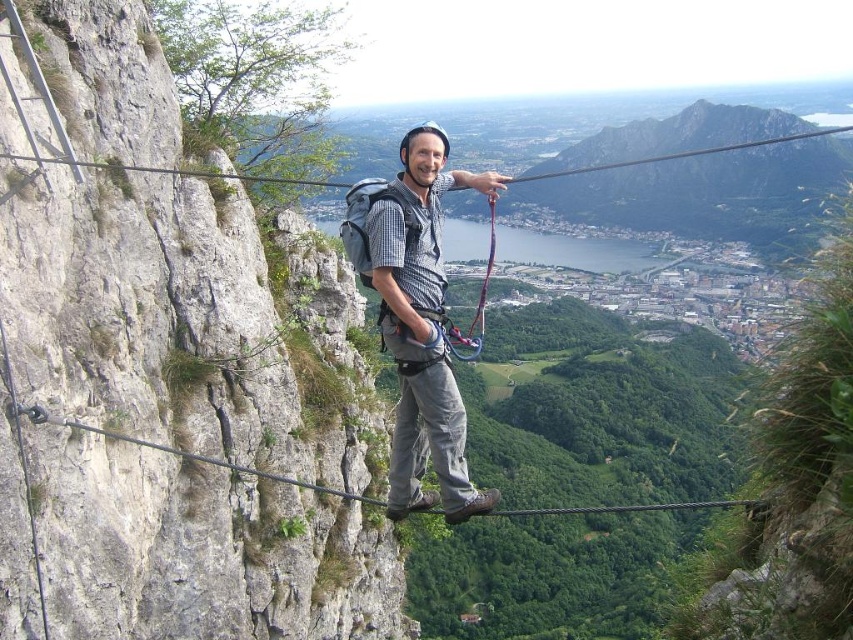
Which is above, smooth gray rock at left or matte gray helmet at center?

smooth gray rock at left is above.

You are a GUI agent. You are given a task and a screenshot of the screen. Output one action in this format:
    pyautogui.click(x=<x>, y=<y>)
    Task: Click on the smooth gray rock at left
    The width and height of the screenshot is (853, 640).
    Given the screenshot: What is the action you would take?
    pyautogui.click(x=184, y=323)